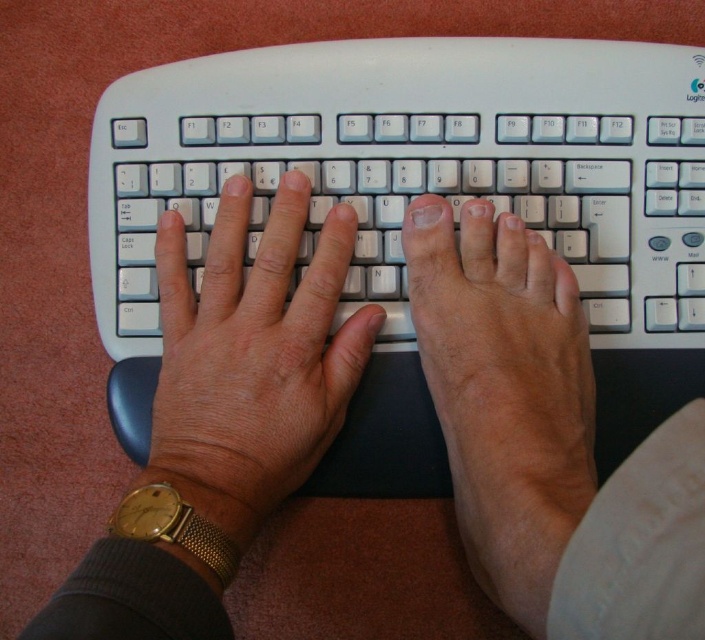
Question: Does matte white foot at center come behind white matte keyboard at center?

Choices:
 (A) no
 (B) yes

Answer: (A)

Question: Among these points, which one is farthest from the camera?

Choices:
 (A) (364, 157)
 (B) (637, 472)

Answer: (A)

Question: Which object is the closest to the white plastic keyboard at center?

Choices:
 (A) matte white foot at center
 (B) white matte keyboard at center
 (C) smooth skin hands at center

Answer: (B)

Question: Does white plastic keyboard at center have a larger size compared to white matte keyboard at center?

Choices:
 (A) no
 (B) yes

Answer: (A)

Question: Is smooth skin hands at center in front of white plastic keyboard at center?

Choices:
 (A) no
 (B) yes

Answer: (B)

Question: Which object is farther from the camera taking this photo?

Choices:
 (A) matte white foot at center
 (B) white matte keyboard at center
 (C) smooth skin hands at center

Answer: (B)